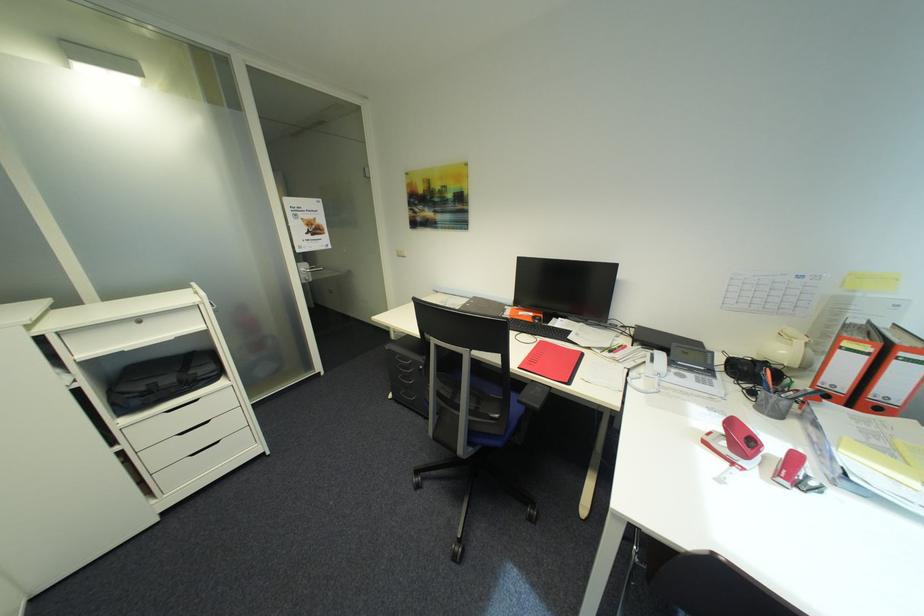
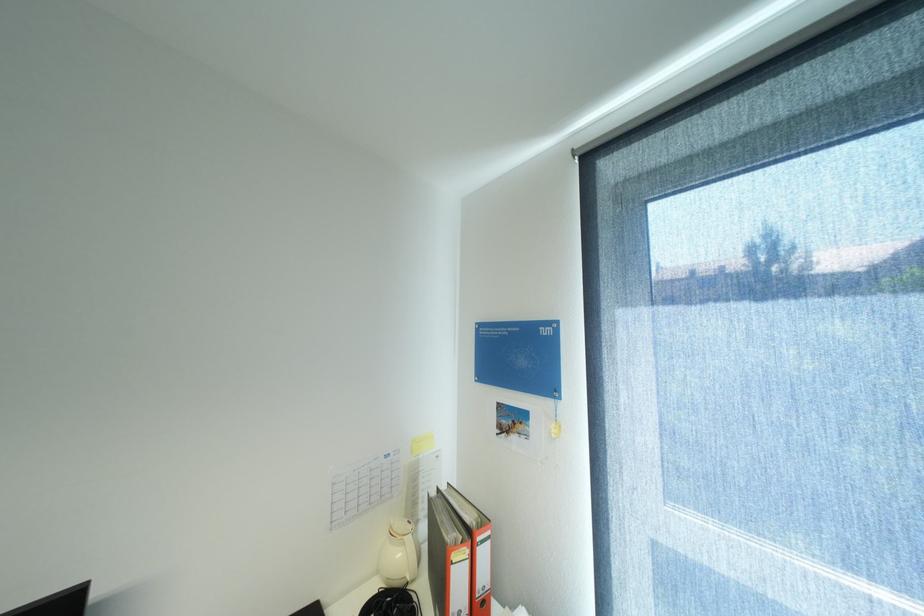
Find the pixel in the second image that matches (793,353) in the first image.

(407, 554)